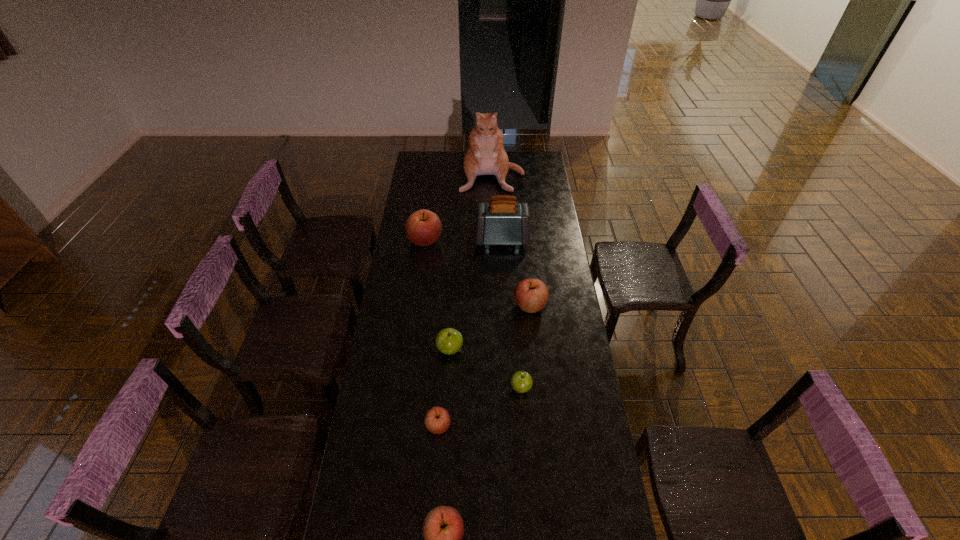
At what (x,y) coordinates should I click in order to perform the action: click on vacant space situated on the front of the right green apple. Please return your answer as a coordinate pair (x, y). This screenshot has height=540, width=960. Looking at the image, I should click on (530, 518).

The height and width of the screenshot is (540, 960). In order to click on blank area located on the right of the third farthest red apple in this screenshot , I will do `click(466, 426)`.

At what (x,y) coordinates should I click in order to perform the action: click on object at the far edge. Please return your answer as a coordinate pair (x, y). This screenshot has width=960, height=540. Looking at the image, I should click on (485, 156).

The width and height of the screenshot is (960, 540). I want to click on object located at the left edge, so click(423, 227).

Find the location of a particular element. The height and width of the screenshot is (540, 960). cat positioned at the right edge is located at coordinates (485, 156).

The width and height of the screenshot is (960, 540). In order to click on apple that is positioned at the right edge in this screenshot , I will do `click(531, 295)`.

Locate an element on the screen. object at the far right corner is located at coordinates (485, 156).

In the image, there is a desktop. What are the coordinates of `free space at the left edge` in the screenshot? It's located at (397, 361).

Identify the location of vacant region at the right edge of the desktop. (549, 347).

Identify the location of vacant area between the bigger green apple and the third farthest red apple. The height and width of the screenshot is (540, 960). (444, 388).